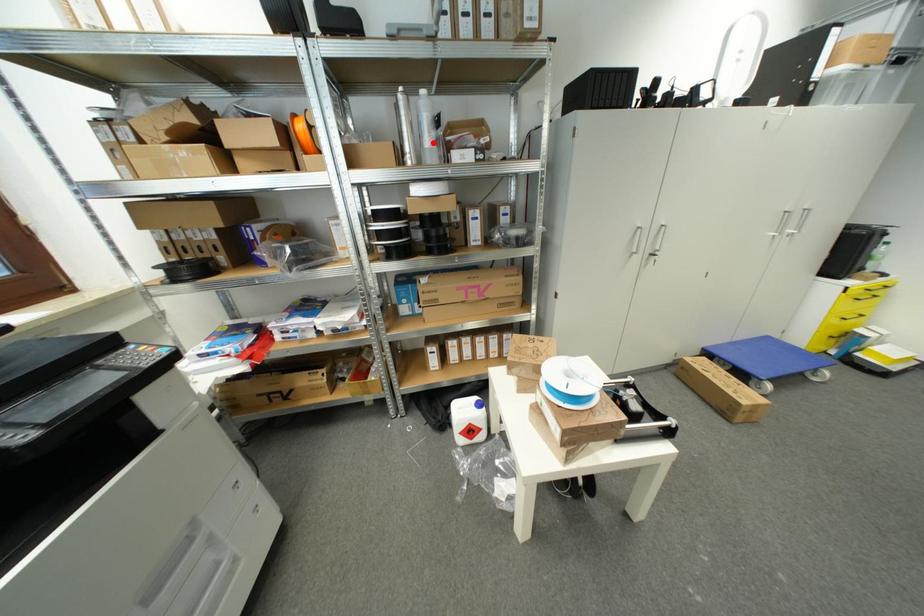
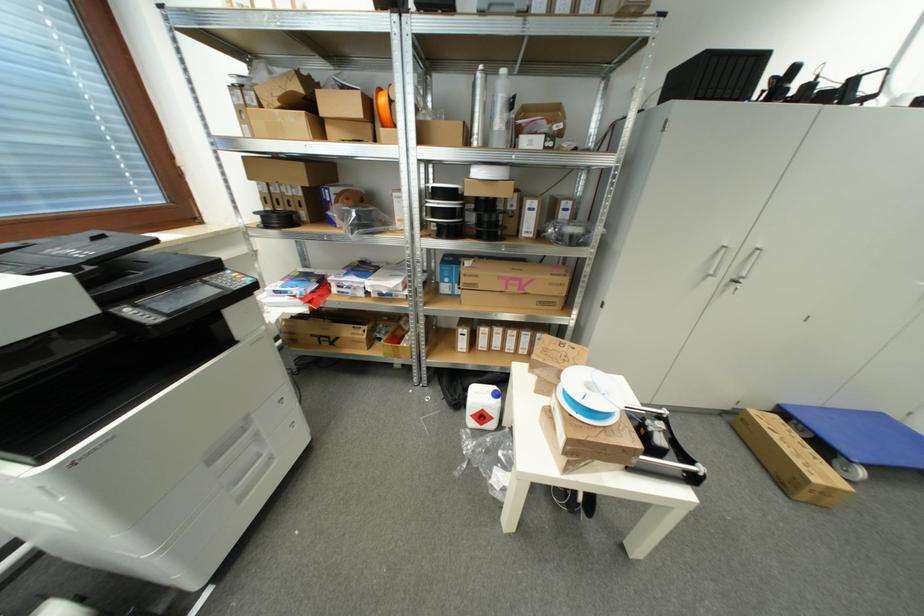
Find the pixel in the second image that matches the highlighted location in the first image.

(504, 126)